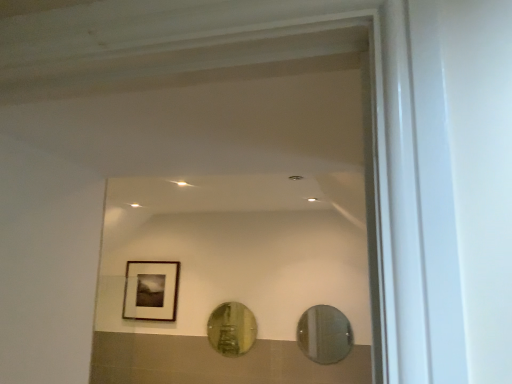
Describe the element at coordinates (324, 334) in the screenshot. This screenshot has width=512, height=384. I see `clear glass mirror at center, the 2th mirror in the left-to-right sequence` at that location.

Where is `clear glass mirror at center, the 1th mirror from the right`? clear glass mirror at center, the 1th mirror from the right is located at coordinates (324, 334).

Does matte black frame at upper left appear on the right side of clear glass mirror at center, the first mirror in the front-to-back sequence?

No.

Does matte black frame at upper left have a smaller size compared to clear glass mirror at center, marked as the second mirror in a back-to-front arrangement?

No.

Does matte black frame at upper left have a greater width compared to clear glass mirror at center, the 2th mirror in the left-to-right sequence?

Yes.

Does gold reflective mirror at center, the first mirror when ordered from left to right, have a larger size compared to clear glass mirror at center, the first mirror in the front-to-back sequence?

Correct, gold reflective mirror at center, the first mirror when ordered from left to right, is larger in size than clear glass mirror at center, the first mirror in the front-to-back sequence.

In terms of width, does gold reflective mirror at center, the second mirror viewed from the right, look wider or thinner when compared to clear glass mirror at center, marked as the second mirror in a back-to-front arrangement?

Clearly, gold reflective mirror at center, the second mirror viewed from the right, has more width compared to clear glass mirror at center, marked as the second mirror in a back-to-front arrangement.

Identify the location of mirror on the left of clear glass mirror at center, the 1th mirror from the right. This screenshot has width=512, height=384. (232, 329).

Is gold reflective mirror at center, which is the second mirror from front to back, closer to the viewer compared to clear glass mirror at center, the 1th mirror from the right?

No, the depth of gold reflective mirror at center, which is the second mirror from front to back, is greater than that of clear glass mirror at center, the 1th mirror from the right.

From the image's perspective, is gold reflective mirror at center, which is the second mirror from front to back, positioned above or below matte black frame at upper left?

gold reflective mirror at center, which is the second mirror from front to back, is below matte black frame at upper left.

Is gold reflective mirror at center, which is the second mirror from front to back, next to matte black frame at upper left?

No, gold reflective mirror at center, which is the second mirror from front to back, is not beside matte black frame at upper left.

Which object is positioned more to the right, gold reflective mirror at center, which is the second mirror from front to back, or matte black frame at upper left?

gold reflective mirror at center, which is the second mirror from front to back.

Based on the photo, considering the sizes of objects gold reflective mirror at center, the second mirror viewed from the right, and matte black frame at upper left in the image provided, who is taller, gold reflective mirror at center, the second mirror viewed from the right, or matte black frame at upper left?

matte black frame at upper left.

Could matte black frame at upper left be considered to be inside clear glass mirror at center, marked as the second mirror in a back-to-front arrangement?

No, matte black frame at upper left is not inside clear glass mirror at center, marked as the second mirror in a back-to-front arrangement.

Is clear glass mirror at center, marked as the second mirror in a back-to-front arrangement, closer to camera compared to matte black frame at upper left?

Yes, clear glass mirror at center, marked as the second mirror in a back-to-front arrangement, is closer to the viewer.

How many degrees apart are the facing directions of clear glass mirror at center, marked as the second mirror in a back-to-front arrangement, and matte black frame at upper left?

The angle between the facing direction of clear glass mirror at center, marked as the second mirror in a back-to-front arrangement, and the facing direction of matte black frame at upper left is 0.0238 degrees.

Which is behind, point (334, 316) or point (128, 303)?

Point (128, 303)

You are a GUI agent. You are given a task and a screenshot of the screen. Output one action in this format:
    pyautogui.click(x=<x>, y=<y>)
    Task: Click on the mirror lying behind the clear glass mirror at center, the 1th mirror from the right
    Image resolution: width=512 pixels, height=384 pixels.
    Given the screenshot: What is the action you would take?
    pyautogui.click(x=232, y=329)

Who is bigger, clear glass mirror at center, the first mirror in the front-to-back sequence, or gold reflective mirror at center, the second mirror viewed from the right?

With larger size is gold reflective mirror at center, the second mirror viewed from the right.

Is clear glass mirror at center, marked as the second mirror in a back-to-front arrangement, looking in the opposite direction of gold reflective mirror at center, which is the second mirror from front to back?

clear glass mirror at center, marked as the second mirror in a back-to-front arrangement, does not have its back to gold reflective mirror at center, which is the second mirror from front to back.

From the image's perspective, between matte black frame at upper left and gold reflective mirror at center, the first mirror in the back-to-front sequence, who is located below?

gold reflective mirror at center, the first mirror in the back-to-front sequence, appears lower in the image.

In the scene shown: Considering the sizes of objects matte black frame at upper left and gold reflective mirror at center, the first mirror when ordered from left to right, in the image provided, who is thinner, matte black frame at upper left or gold reflective mirror at center, the first mirror when ordered from left to right,?

gold reflective mirror at center, the first mirror when ordered from left to right.

Between matte black frame at upper left and gold reflective mirror at center, the first mirror when ordered from left to right, which one has more height?

With more height is matte black frame at upper left.

Is matte black frame at upper left positioned with its back to gold reflective mirror at center, the second mirror viewed from the right?

That's not correct — matte black frame at upper left is not looking away from gold reflective mirror at center, the second mirror viewed from the right.

Identify the location of picture frame that appears above the clear glass mirror at center, the 2th mirror in the left-to-right sequence (from the image's perspective). Image resolution: width=512 pixels, height=384 pixels. (151, 290).

You are a GUI agent. You are given a task and a screenshot of the screen. Output one action in this format:
    pyautogui.click(x=<x>, y=<y>)
    Task: Click on the mirror directly beneath the gold reflective mirror at center, the first mirror when ordered from left to right (from a real-world perspective)
    
    Given the screenshot: What is the action you would take?
    pyautogui.click(x=324, y=334)

From the picture: Estimate the real-world distances between objects in this image. Which object is closer to gold reflective mirror at center, the second mirror viewed from the right, matte black frame at upper left or clear glass mirror at center, the 2th mirror in the left-to-right sequence?

Among the two, clear glass mirror at center, the 2th mirror in the left-to-right sequence, is located nearer to gold reflective mirror at center, the second mirror viewed from the right.

Estimate the real-world distances between objects in this image. Which object is further from gold reflective mirror at center, which is the second mirror from front to back, clear glass mirror at center, marked as the second mirror in a back-to-front arrangement, or matte black frame at upper left?

matte black frame at upper left is positioned further to the anchor gold reflective mirror at center, which is the second mirror from front to back.

Estimate the real-world distances between objects in this image. Which object is further from matte black frame at upper left, clear glass mirror at center, marked as the second mirror in a back-to-front arrangement, or gold reflective mirror at center, which is the second mirror from front to back?

clear glass mirror at center, marked as the second mirror in a back-to-front arrangement, is positioned further to the anchor matte black frame at upper left.

When comparing their distances from matte black frame at upper left, does gold reflective mirror at center, the second mirror viewed from the right, or clear glass mirror at center, the first mirror in the front-to-back sequence, seem closer?

gold reflective mirror at center, the second mirror viewed from the right, is positioned closer to the anchor matte black frame at upper left.

Considering their positions, is gold reflective mirror at center, which is the second mirror from front to back, positioned further to clear glass mirror at center, marked as the second mirror in a back-to-front arrangement, than matte black frame at upper left?

matte black frame at upper left is further to clear glass mirror at center, marked as the second mirror in a back-to-front arrangement.

Based on their spatial positions, is matte black frame at upper left or gold reflective mirror at center, which is the second mirror from front to back, further from clear glass mirror at center, marked as the second mirror in a back-to-front arrangement?

matte black frame at upper left lies further to clear glass mirror at center, marked as the second mirror in a back-to-front arrangement, than the other object.

Find the location of a particular element. The height and width of the screenshot is (384, 512). mirror located between matte black frame at upper left and clear glass mirror at center, the 2th mirror in the left-to-right sequence, in the left-right direction is located at coordinates (232, 329).